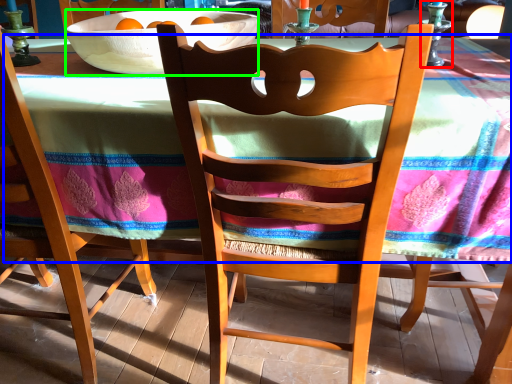
Question: Which object is positioned farthest from candle holder (highlighted by a red box)? Select from tablecloth (highlighted by a blue box) and bowl (highlighted by a green box).

Choices:
 (A) tablecloth
 (B) bowl

Answer: (B)